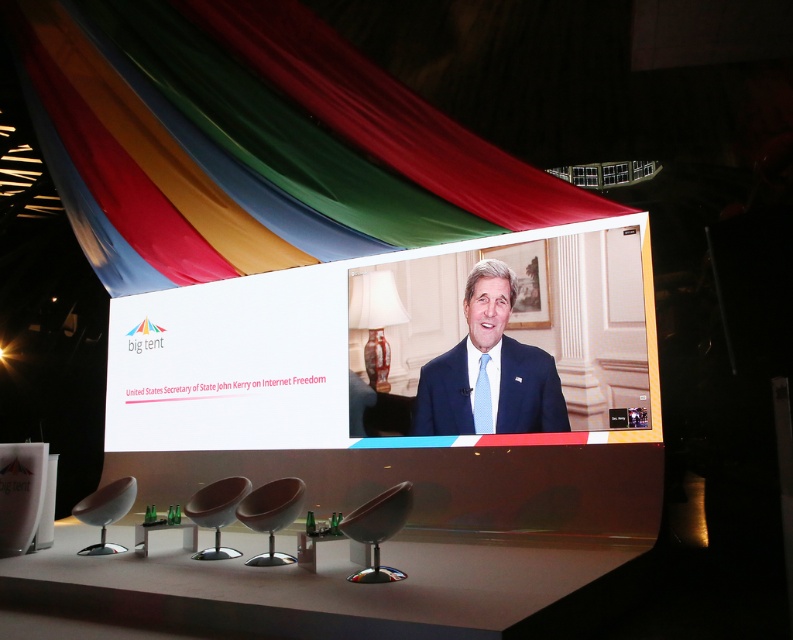
Question: Is blue textured suit at center thinner than metallic brown chair at lower center?

Choices:
 (A) yes
 (B) no

Answer: (B)

Question: Which of the following is the farthest from the observer?

Choices:
 (A) (416, 106)
 (B) (224, 504)
 (C) (98, 541)

Answer: (C)

Question: Is white glossy projection screen at center thinner than matte black chair at center?

Choices:
 (A) yes
 (B) no

Answer: (B)

Question: Which object is positioned closest to the blue textured suit at center?

Choices:
 (A) metallic brown chair at lower center
 (B) multicolored fabric at upper center
 (C) matte black chair at center

Answer: (C)

Question: Which point is farther to the camera?

Choices:
 (A) (217, 554)
 (B) (293, 512)
 (C) (405, 515)

Answer: (A)

Question: Can you confirm if multicolored fabric at upper center is positioned above blue textured suit at center?

Choices:
 (A) yes
 (B) no

Answer: (A)